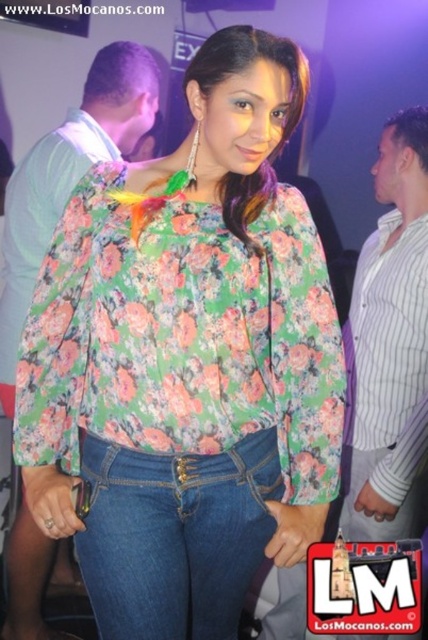
Who is positioned more to the right, striped cotton shirt at right or floral fabric shirt at upper left?

striped cotton shirt at right is more to the right.

Does point (421, 310) come in front of point (59, 179)?

Yes, point (421, 310) is closer to viewer.

Identify the location of striped cotton shirt at right. The width and height of the screenshot is (428, 640). (392, 344).

You are a GUI agent. You are given a task and a screenshot of the screen. Output one action in this format:
    pyautogui.click(x=<x>, y=<y>)
    Task: Click on the striped cotton shirt at right
    This screenshot has width=428, height=640.
    Given the screenshot: What is the action you would take?
    pyautogui.click(x=392, y=344)

Is the position of denim jeans at center more distant than that of striped cotton shirt at right?

That is False.

The height and width of the screenshot is (640, 428). What do you see at coordinates (175, 536) in the screenshot?
I see `denim jeans at center` at bounding box center [175, 536].

Where is `denim jeans at center`? Image resolution: width=428 pixels, height=640 pixels. denim jeans at center is located at coordinates (175, 536).

Can you confirm if denim jeans at center is positioned above floral fabric shirt at upper left?

Actually, denim jeans at center is below floral fabric shirt at upper left.

Which is in front, point (104, 502) or point (12, 598)?

Positioned in front is point (104, 502).

The width and height of the screenshot is (428, 640). I want to click on denim jeans at center, so click(x=175, y=536).